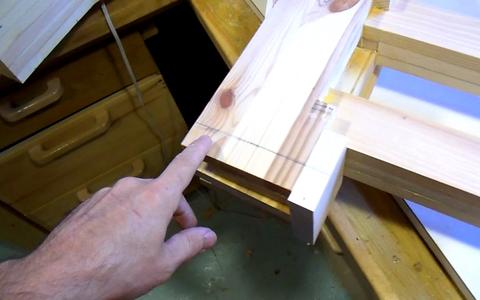
At what (x,y) coordinates should I click in order to perform the action: click on flat surface. Please return your answer as a coordinate pair (x, y). Looking at the image, I should click on (388, 225), (88, 73), (127, 121), (154, 160), (257, 97).